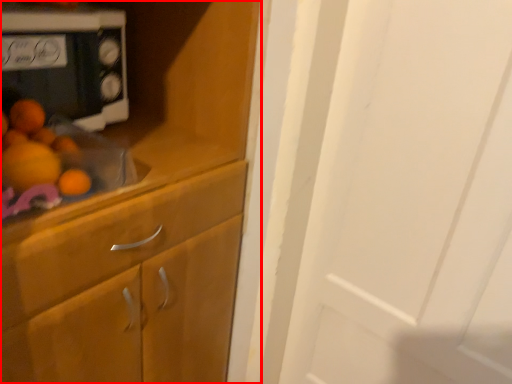
Question: From the image's perspective, what is the correct spatial positioning of cabinetry (annotated by the red box) in reference to home appliance?

Choices:
 (A) above
 (B) below

Answer: (B)